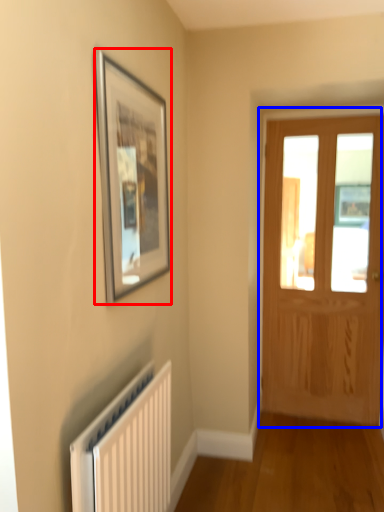
Question: Which point is further to the camera, picture frame (highlighted by a red box) or door (highlighted by a blue box)?

Choices:
 (A) picture frame
 (B) door

Answer: (B)